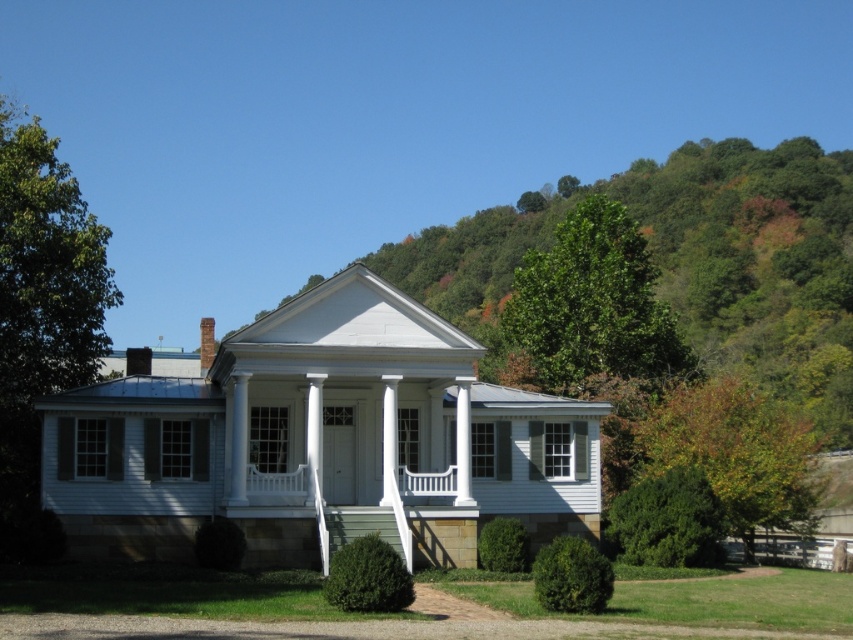
Question: Based on their relative distances, which object is farther from the green leafy tree at upper center?

Choices:
 (A) green leafy tree at right
 (B) green leafy hillside at upper center

Answer: (B)

Question: Observing the image, what is the correct spatial positioning of green leafy hillside at upper center in reference to green leafy tree at right?

Choices:
 (A) right
 (B) left

Answer: (A)

Question: Is green leafy tree at upper center closer to camera compared to green leafy tree at right?

Choices:
 (A) no
 (B) yes

Answer: (A)

Question: Does green leafy tree at upper center have a smaller size compared to green leafy tree at right?

Choices:
 (A) no
 (B) yes

Answer: (A)

Question: Estimate the real-world distances between objects in this image. Which object is closer to the green leafy tree at right?

Choices:
 (A) green leafy hillside at upper center
 (B) green leafy tree at upper center

Answer: (B)

Question: Which point is farther to the camera?

Choices:
 (A) (618, 324)
 (B) (795, 289)
 (C) (782, 424)

Answer: (B)